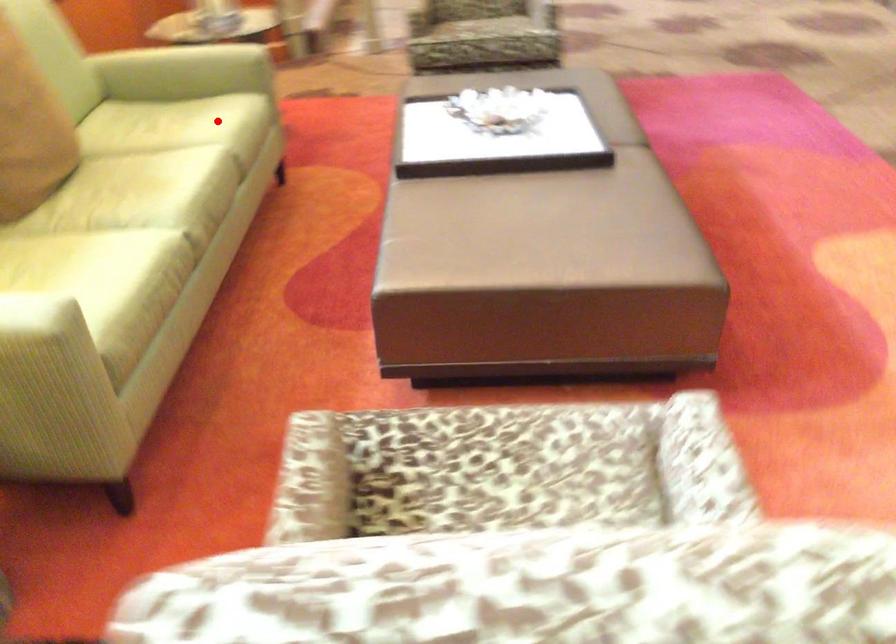
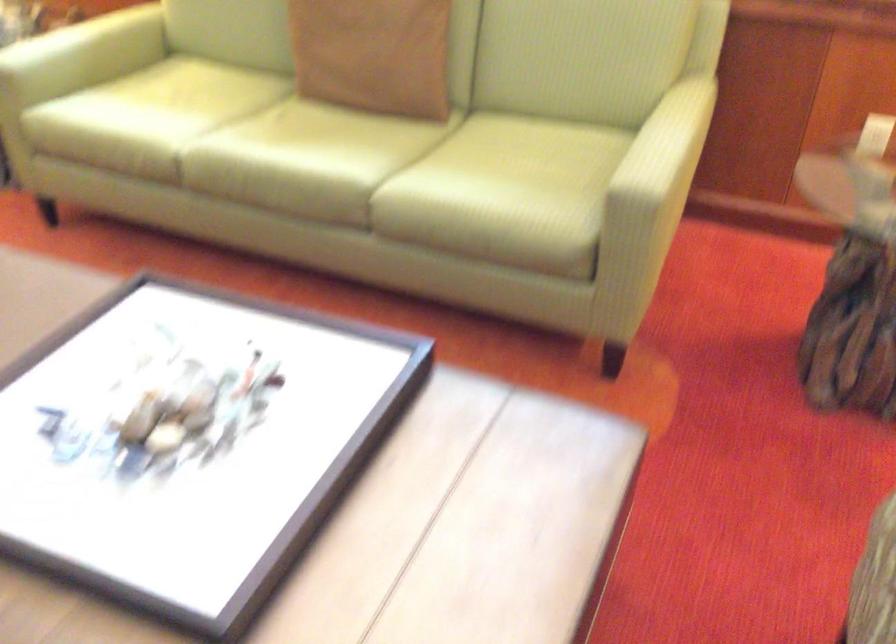
Question: I am providing you with two images of the same scene from different viewpoints. A red point is shown in image1. For the corresponding object point in image2, is it positioned nearer or farther from the camera?

Choices:
 (A) Nearer
 (B) Farther

Answer: (A)